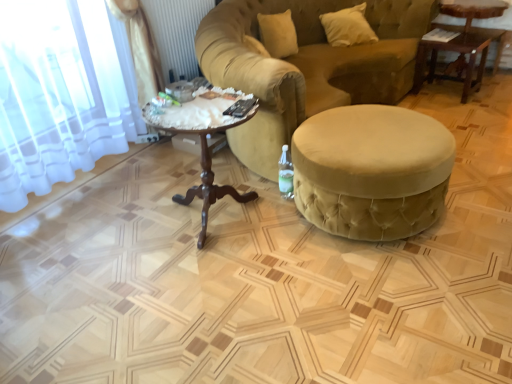
Question: Is the surface of mahogany wood coffee table at center in direct contact with wooden table at upper right, placed as the second table when sorted from left to right?

Choices:
 (A) yes
 (B) no

Answer: (B)

Question: Can you confirm if mahogany wood coffee table at center is shorter than wooden table at upper right, which ranks as the 1th table in back-to-front order?

Choices:
 (A) yes
 (B) no

Answer: (B)

Question: Are mahogany wood coffee table at center and wooden table at upper right, which ranks as the 1th table in back-to-front order, located far from each other?

Choices:
 (A) no
 (B) yes

Answer: (B)

Question: Does mahogany wood coffee table at center have a greater height compared to wooden table at upper right, acting as the first table starting from the right?

Choices:
 (A) no
 (B) yes

Answer: (B)

Question: Is mahogany wood coffee table at center facing away from wooden table at upper right, acting as the first table starting from the right?

Choices:
 (A) yes
 (B) no

Answer: (B)

Question: Do you think velvet beige ottoman at center, which appears as the 1th table when ordered from the bottom, is within mahogany wood coffee table at center, or outside of it?

Choices:
 (A) outside
 (B) inside

Answer: (A)

Question: Considering the positions of velvet beige ottoman at center, which is the first table in front-to-back order, and mahogany wood coffee table at center in the image, is velvet beige ottoman at center, which is the first table in front-to-back order, bigger or smaller than mahogany wood coffee table at center?

Choices:
 (A) big
 (B) small

Answer: (A)

Question: From a real-world perspective, is velvet beige ottoman at center, which is the first table in left-to-right order, above or below mahogany wood coffee table at center?

Choices:
 (A) below
 (B) above

Answer: (A)

Question: Is velvet beige ottoman at center, which is the first table in left-to-right order, wider or thinner than mahogany wood coffee table at center?

Choices:
 (A) wide
 (B) thin

Answer: (A)

Question: Is white soft pillow at upper right to the left or to the right of wooden table at upper right, which is counted as the 1th table, starting from the top, in the image?

Choices:
 (A) left
 (B) right

Answer: (A)

Question: Considering the positions of white soft pillow at upper right and wooden table at upper right, which ranks as the 1th table in back-to-front order, in the image, is white soft pillow at upper right taller or shorter than wooden table at upper right, which ranks as the 1th table in back-to-front order,?

Choices:
 (A) short
 (B) tall

Answer: (A)

Question: In the image, is white soft pillow at upper right positioned in front of or behind wooden table at upper right, placed as the second table when sorted from left to right?

Choices:
 (A) behind
 (B) front

Answer: (A)

Question: From the image's perspective, is white soft pillow at upper right located above or below wooden table at upper right, which ranks as the 1th table in back-to-front order?

Choices:
 (A) below
 (B) above

Answer: (B)

Question: In terms of height, does clear glass bottle at lower right look taller or shorter compared to velvet yellow studio couch at center?

Choices:
 (A) short
 (B) tall

Answer: (A)

Question: Is clear glass bottle at lower right in front of or behind velvet yellow studio couch at center in the image?

Choices:
 (A) front
 (B) behind

Answer: (B)